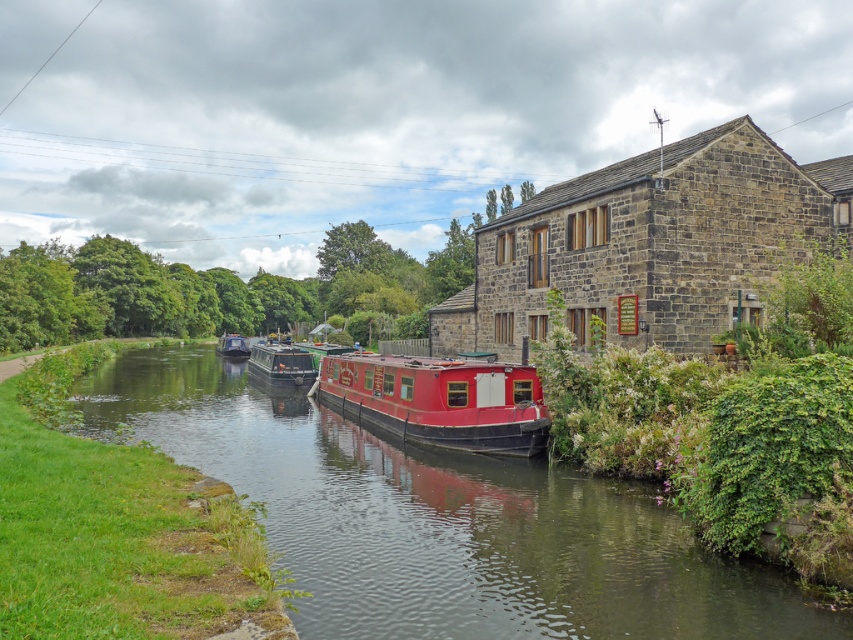
Which is more to the right, smooth water at center or matte black boat at center?

smooth water at center is more to the right.

Does smooth water at center appear on the left side of matte black boat at center?

No, smooth water at center is not to the left of matte black boat at center.

What do you see at coordinates (439, 522) in the screenshot?
I see `smooth water at center` at bounding box center [439, 522].

Image resolution: width=853 pixels, height=640 pixels. What are the coordinates of `smooth water at center` in the screenshot? It's located at (439, 522).

Looking at this image, which is above, smooth water at center or metallic gray barge at center?

metallic gray barge at center

Which is behind, point (192, 465) or point (294, 348)?

The point (294, 348) is more distant.

Where is `smooth water at center`? smooth water at center is located at coordinates (439, 522).

Who is lower down, shiny red barge at center or matte black boat at center?

Positioned lower is shiny red barge at center.

Image resolution: width=853 pixels, height=640 pixels. Find the location of `shiny red barge at center`. shiny red barge at center is located at coordinates (440, 401).

The height and width of the screenshot is (640, 853). I want to click on shiny red barge at center, so click(440, 401).